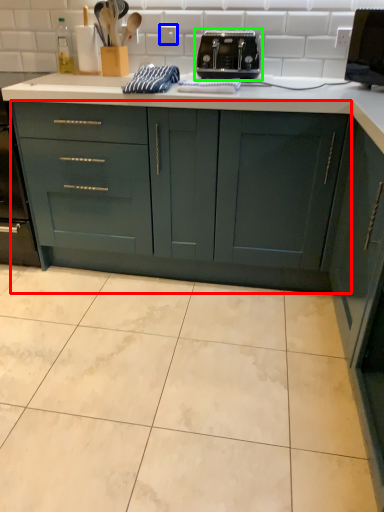
Question: Based on their relative distances, which object is farther from cabinetry (highlighted by a red box)? Choose from electric outlet (highlighted by a blue box) and toaster (highlighted by a green box).

Choices:
 (A) electric outlet
 (B) toaster

Answer: (A)